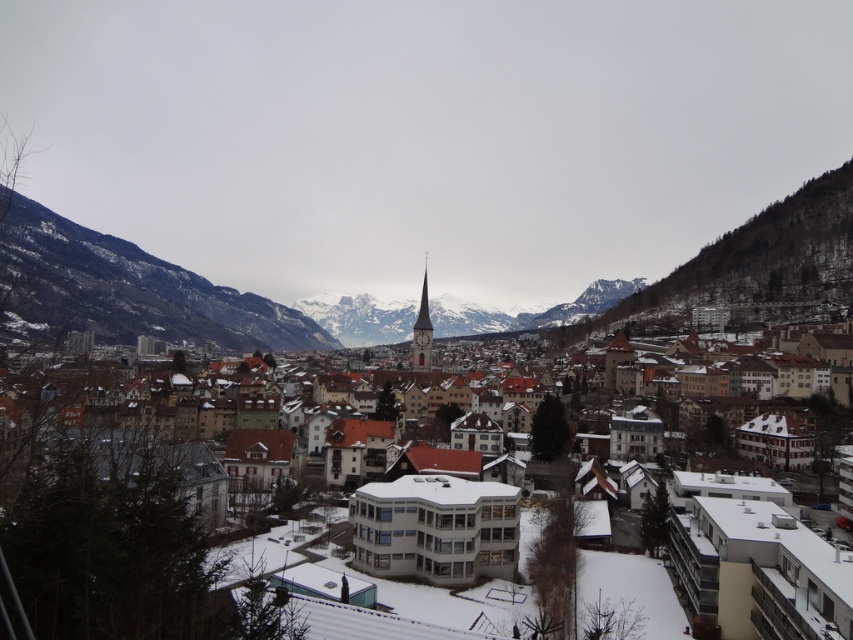
Locate an element on the screen. white matte building at center is located at coordinates (763, 579).

Which is above, white matte building at center or rocky brown mountain at left?

rocky brown mountain at left is higher up.

Who is more distant from viewer, (39, 552) or (231, 326)?

Positioned behind is point (231, 326).

Locate an element on the screen. white matte building at center is located at coordinates (763, 579).